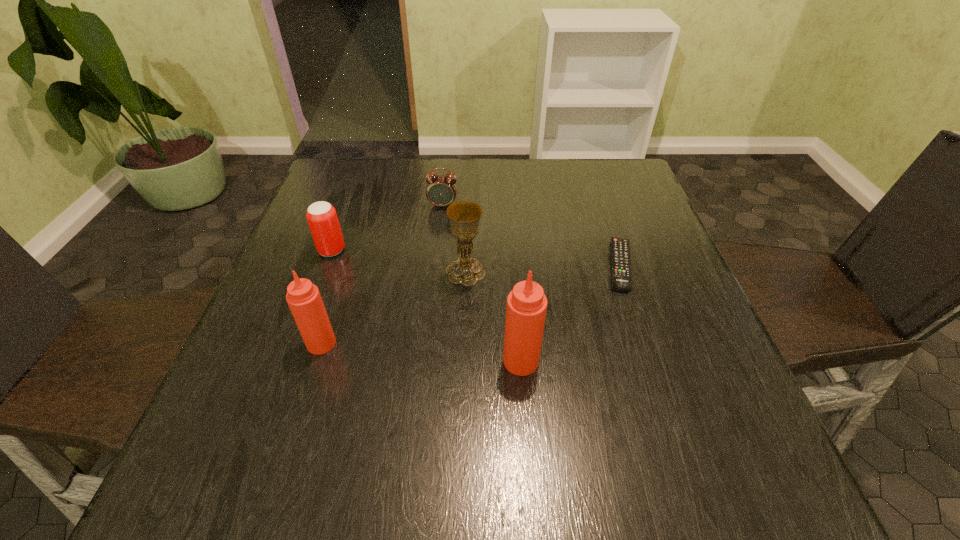
The width and height of the screenshot is (960, 540). In order to click on free spot at the left edge of the desktop in this screenshot , I will do `click(290, 359)`.

Where is `vacant space at the right edge of the desktop`? The image size is (960, 540). vacant space at the right edge of the desktop is located at coordinates (666, 327).

In the image, there is a desktop. Where is `vacant space at the far left corner`? Image resolution: width=960 pixels, height=540 pixels. vacant space at the far left corner is located at coordinates (372, 174).

The image size is (960, 540). What are the coordinates of `free space at the far right corner` in the screenshot? It's located at (632, 191).

Identify the location of free spot between the left Tabasco sauce and the chalice. (394, 308).

Identify the location of free point between the chalice and the beer can. (398, 261).

The width and height of the screenshot is (960, 540). What are the coordinates of `vacant space that is in between the left Tabasco sauce and the farthest object` in the screenshot? It's located at (382, 274).

Find the location of `vacant space that's between the beer can and the rightmost object`. vacant space that's between the beer can and the rightmost object is located at coordinates (476, 258).

Locate an element on the screen. The width and height of the screenshot is (960, 540). free space between the shortest object and the alarm clock is located at coordinates (531, 235).

This screenshot has width=960, height=540. What are the coordinates of `free space between the left Tabasco sauce and the tallest object` in the screenshot? It's located at (421, 352).